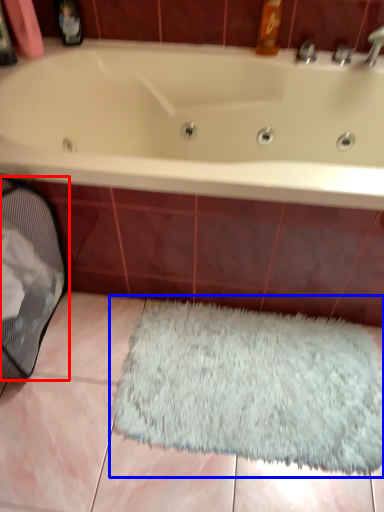
Question: Which object is further to the camera taking this photo, laundry basket (highlighted by a red box) or doormat (highlighted by a blue box)?

Choices:
 (A) laundry basket
 (B) doormat

Answer: (B)